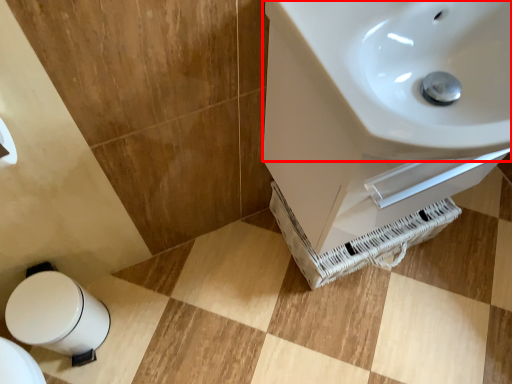
Question: From the image's perspective, what is the correct spatial positioning of sink (annotated by the red box) in reference to bidet?

Choices:
 (A) below
 (B) above

Answer: (B)